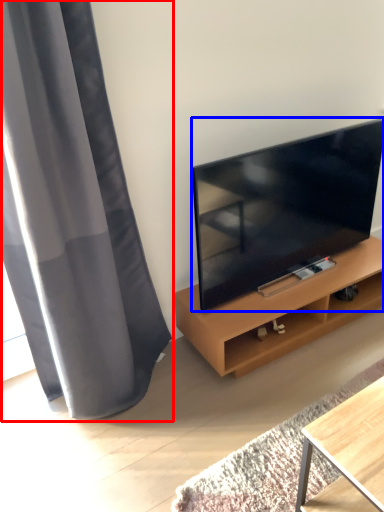
Question: Which object appears closest to the camera in this image, curtain (highlighted by a red box) or television (highlighted by a blue box)?

Choices:
 (A) curtain
 (B) television

Answer: (A)